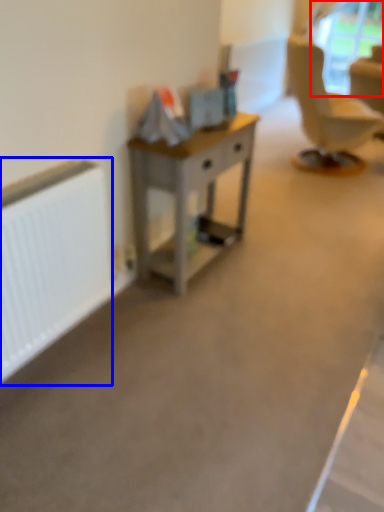
Question: Which object appears farthest to the camera in this image, window screen (highlighted by a red box) or radiator (highlighted by a blue box)?

Choices:
 (A) window screen
 (B) radiator

Answer: (A)